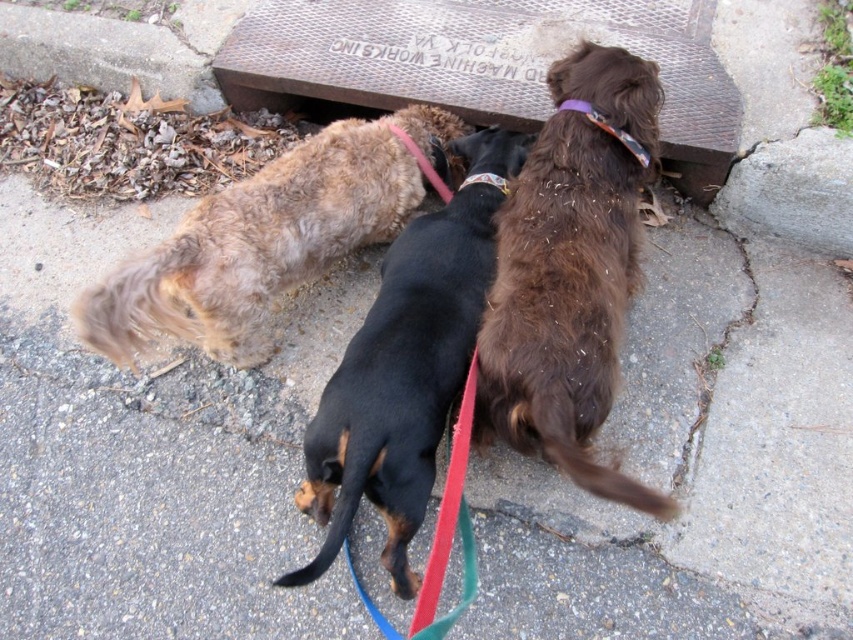
Question: Which point is farther to the camera?

Choices:
 (A) (498, 188)
 (B) (607, 124)

Answer: (A)

Question: Which of the following is the closest to the observer?

Choices:
 (A) (259, 49)
 (B) (590, 289)
 (C) (270, 269)
 (D) (695, 488)

Answer: (B)

Question: Is purple fabric neckband at upper center above multicolored fabric collar at center?

Choices:
 (A) yes
 (B) no

Answer: (A)

Question: Can you confirm if rusty metal bench at center is positioned below brown fuzzy dog at center?

Choices:
 (A) yes
 (B) no

Answer: (B)

Question: Is brown furry dog at center below purple fabric neckband at upper center?

Choices:
 (A) yes
 (B) no

Answer: (A)

Question: Which point is farther from the camera taking this photo?

Choices:
 (A) (579, 102)
 (B) (497, 182)

Answer: (B)